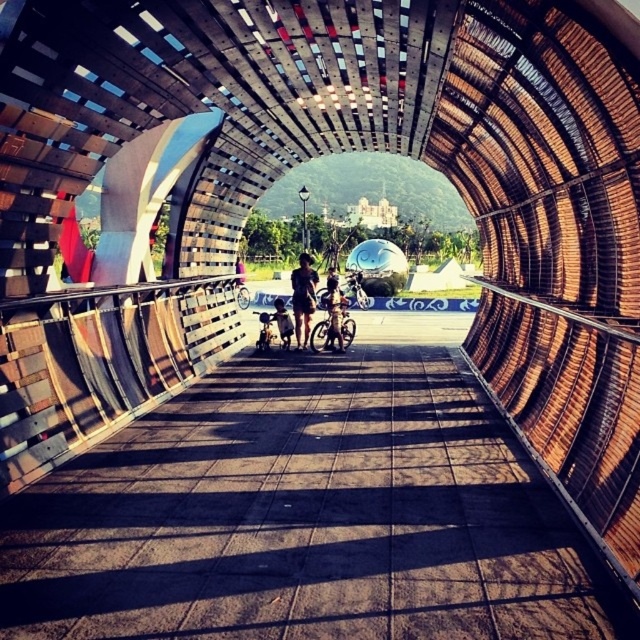
Based on the photo, who is higher up, dark brown shorts at center or silver metallic bicycle at center?

silver metallic bicycle at center is higher up.

Does point (300, 264) come farther from viewer compared to point (241, 284)?

No.

You are a GUI agent. You are given a task and a screenshot of the screen. Output one action in this format:
    pyautogui.click(x=<x>, y=<y>)
    Task: Click on the dark brown shorts at center
    The image size is (640, 640).
    Given the screenshot: What is the action you would take?
    pos(304,296)

Between point (346, 336) and point (227, 285), which one is positioned in front?

Point (227, 285) is in front.

Which is more to the right, metallic silver bicycle at center or silver metallic bicycle at center?

Positioned to the right is metallic silver bicycle at center.

Is point (317, 324) positioned behind point (237, 285)?

No, (317, 324) is closer to viewer.

Identify the location of metallic silver bicycle at center. (317, 336).

Who is positioned more to the right, brown concrete path at center or dark brown shorts at center?

dark brown shorts at center

Does point (522, 611) come closer to viewer compared to point (307, 266)?

Yes, it is.

Looking at this image, who is more distant from viewer, (x=241, y=381) or (x=298, y=323)?

The point (x=298, y=323) is more distant.

What are the coordinates of `brown concrete path at center` in the screenshot? It's located at (307, 516).